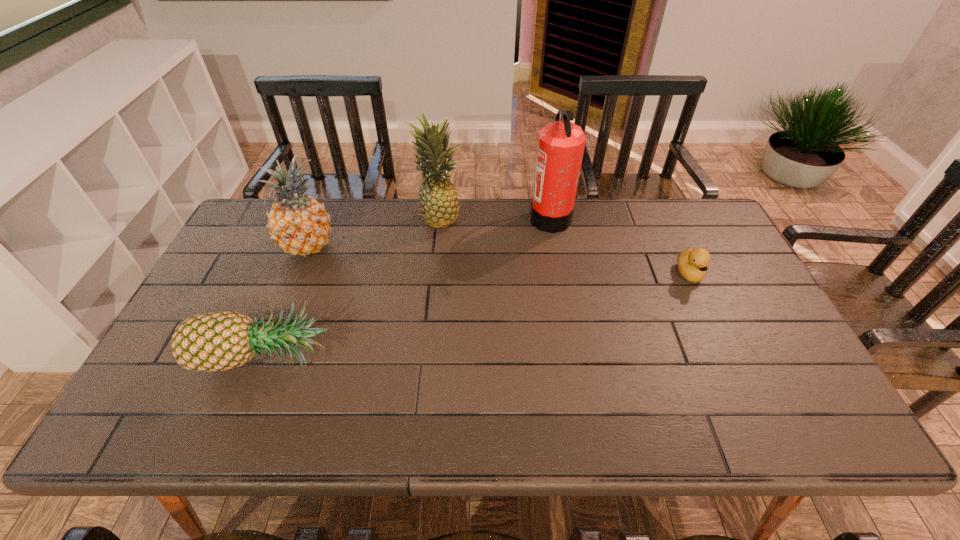
Identify the location of fire extinguisher. (561, 144).

Image resolution: width=960 pixels, height=540 pixels. In order to click on the tallest pineapple in this screenshot , I will do `click(438, 203)`.

You are a GUI agent. You are given a task and a screenshot of the screen. Output one action in this format:
    pyautogui.click(x=<x>, y=<y>)
    Task: Click on the third object from left to right
    The height and width of the screenshot is (540, 960).
    Given the screenshot: What is the action you would take?
    438,203

I want to click on the third shortest object, so click(298, 224).

Find the location of a particular element. This screenshot has height=540, width=960. the nearest object is located at coordinates (217, 341).

The width and height of the screenshot is (960, 540). Find the location of `the shortest pineapple`. the shortest pineapple is located at coordinates (217, 341).

What are the coordinates of `duckling` in the screenshot? It's located at (692, 264).

Locate an element on the screen. The image size is (960, 540). the rightmost object is located at coordinates (692, 264).

At what (x,y) coordinates should I click in order to perform the action: click on free space located 0.230m on the front side of the fire extinguisher. Please return your answer as a coordinate pair (x, y). Looking at the image, I should click on (461, 217).

The height and width of the screenshot is (540, 960). Find the location of `free region located 0.160m on the front side of the fire extinguisher`. free region located 0.160m on the front side of the fire extinguisher is located at coordinates (482, 217).